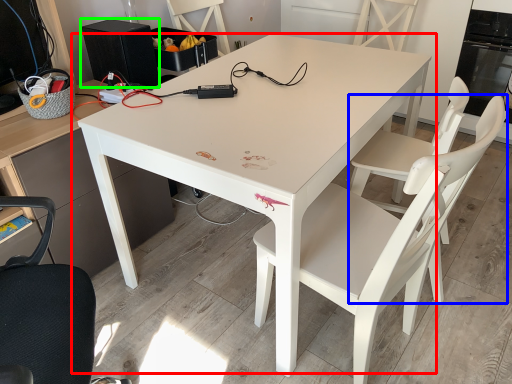
Question: Which object is positioned farthest from table (highlighted by a red box)? Select from armchair (highlighted by a blue box) and appliance (highlighted by a green box).

Choices:
 (A) armchair
 (B) appliance

Answer: (A)